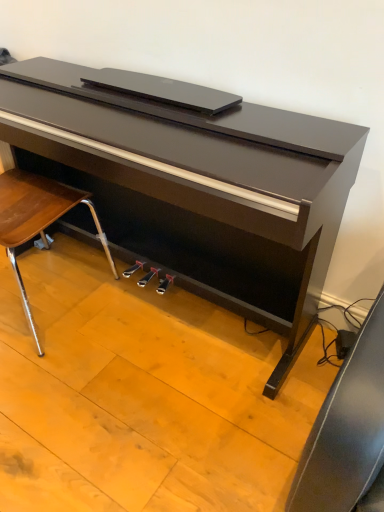
Find the location of a particular element. free point to the right of wooden/matte chair at lower left is located at coordinates (136, 340).